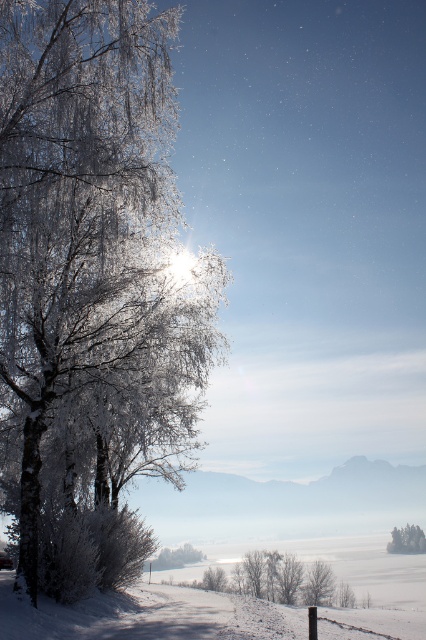
You are standing at the center of the image and want to walk towards the frosted glass tree at left. Which direction should you face to head directly towards it?

The frosted glass tree at left is located at point (78, 205), so you should face towards the left to head directly towards it.

Looking at this image, you are standing at the center of the path in the winter scene. You see the frosted glass tree at left and the white frosty tree at lower right. Which tree is closer to your left side?

The frosted glass tree at left is positioned on the left side of white frosty tree at lower right, so it is closer to your left side.

You are standing at the center of the path in the winter landscape scene. You see the point marked as point (78,205). What object does this point represent?

The point (78,205) corresponds to the frosted glass tree at left.